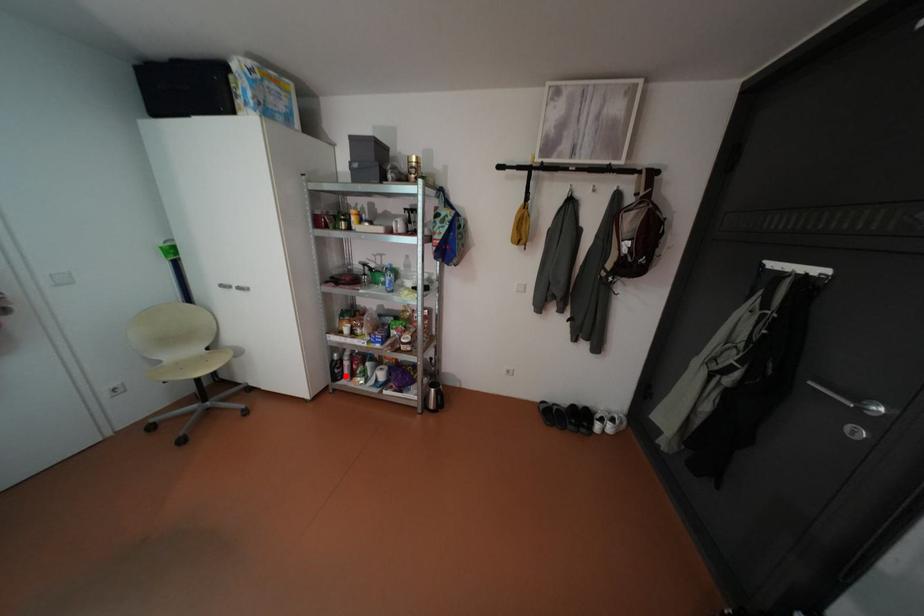
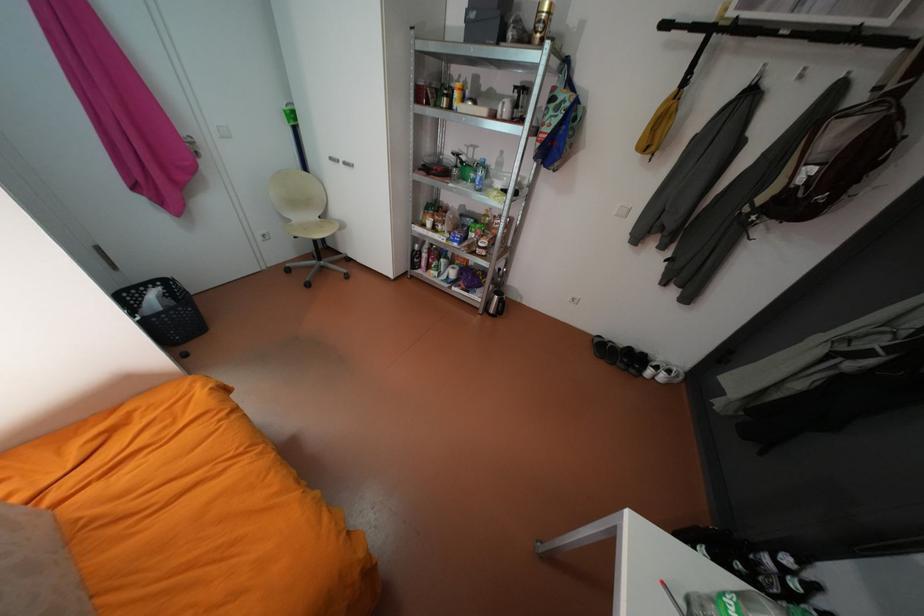
Question: A red point is marked in image1. In image2, is the corresponding 3D point closer to the camera or farther? Reply with the corresponding letter.

Choices:
 (A) The corresponding 3D point is closer.
 (B) The corresponding 3D point is farther.

Answer: (A)